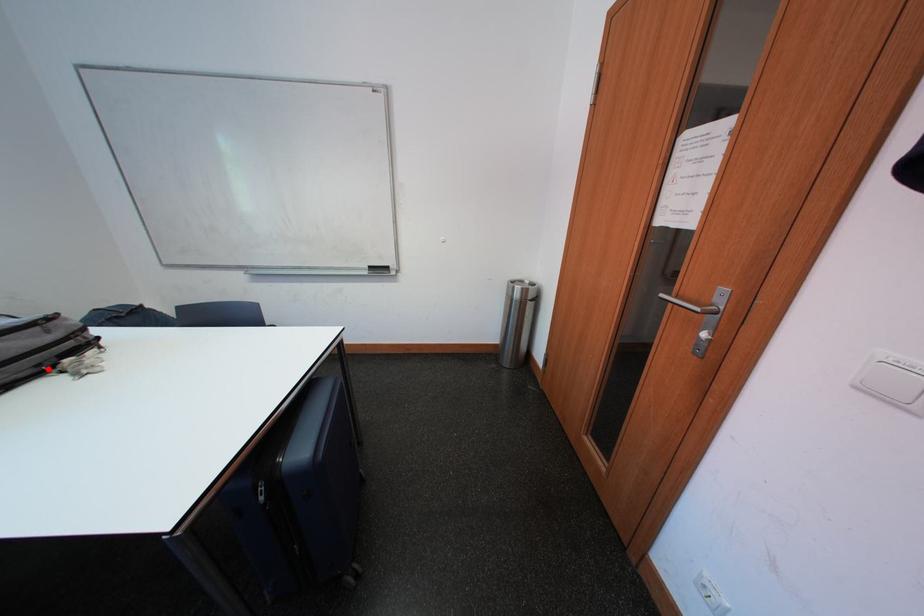
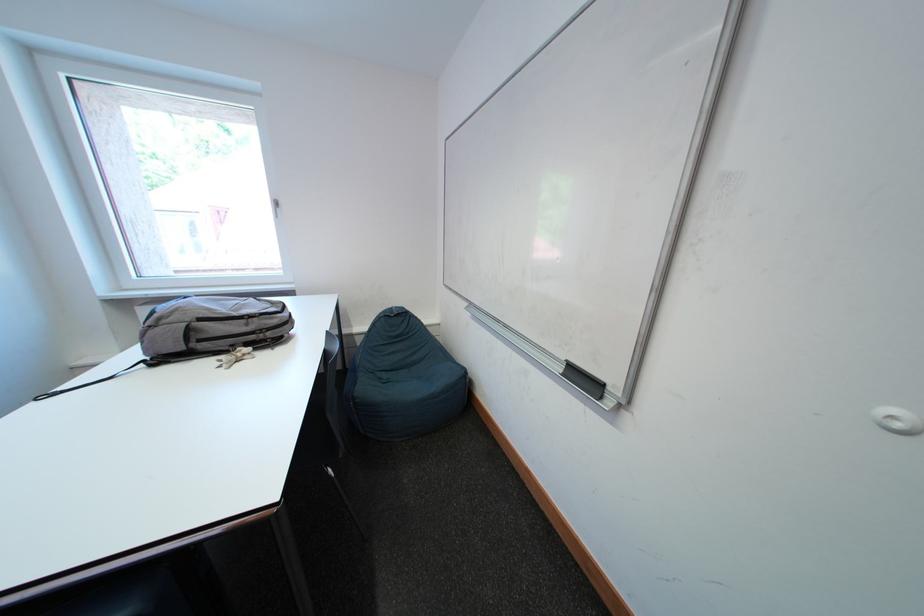
In the second image, find the point that corresponds to the highlighted location in the first image.

(241, 349)